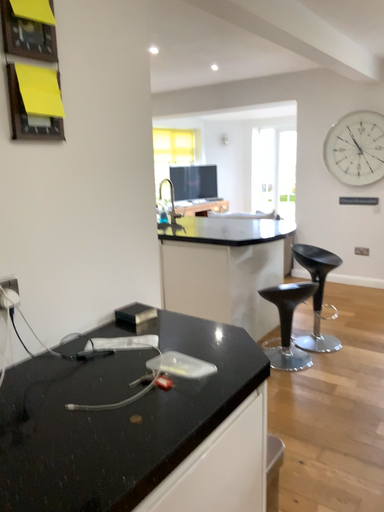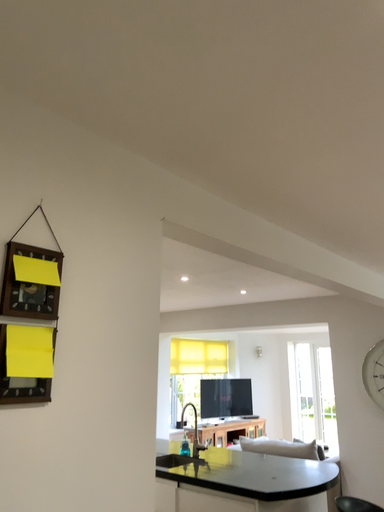
Question: How did the camera likely rotate when shooting the video?

Choices:
 (A) rotated downward
 (B) rotated upward

Answer: (B)